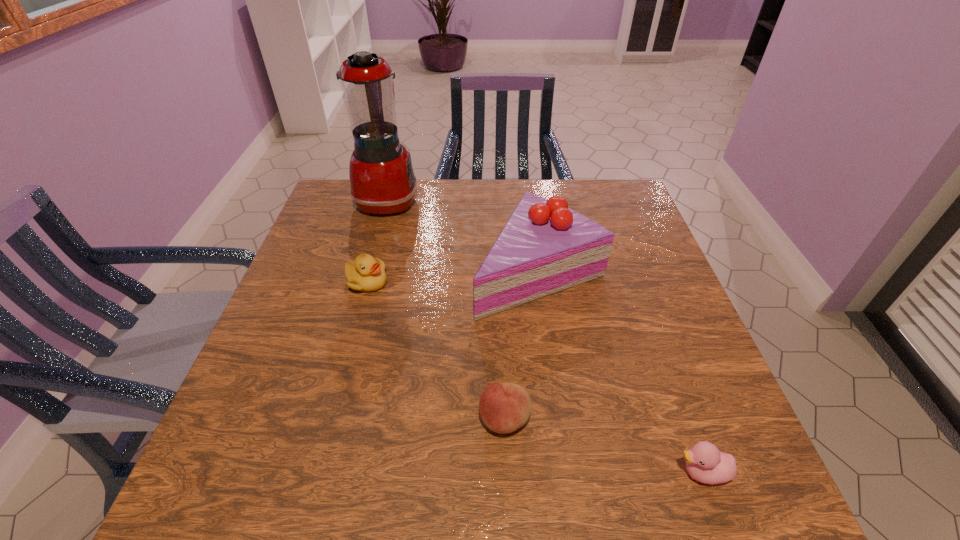
Identify the location of free spot between the rightmost object and the left duckling. (534, 377).

Identify the location of vacant point located between the cake and the nearer duckling. This screenshot has width=960, height=540. [620, 372].

I want to click on free space between the nearer duckling and the fourth farthest object, so click(x=603, y=446).

The height and width of the screenshot is (540, 960). I want to click on empty space that is in between the farthest object and the left duckling, so click(x=377, y=241).

I want to click on vacant space that is in between the tallest object and the nearer duckling, so click(544, 337).

Locate an element on the screen. free space between the fourth farthest object and the left duckling is located at coordinates (436, 350).

This screenshot has height=540, width=960. In order to click on free space between the fourth shortest object and the left duckling in this screenshot , I will do `click(453, 276)`.

Identify the location of vacant space in between the food processor and the second nearest object. The width and height of the screenshot is (960, 540). (446, 310).

Identify the location of empty space between the right duckling and the fourth shortest object. (620, 372).

The image size is (960, 540). I want to click on object that stands as the second closest to the farther duckling, so click(545, 247).